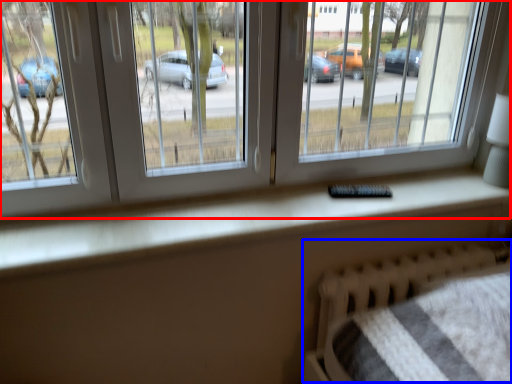
Question: Which object appears closest to the camera in this image, window (highlighted by a red box) or hospital bed (highlighted by a blue box)?

Choices:
 (A) window
 (B) hospital bed

Answer: (A)